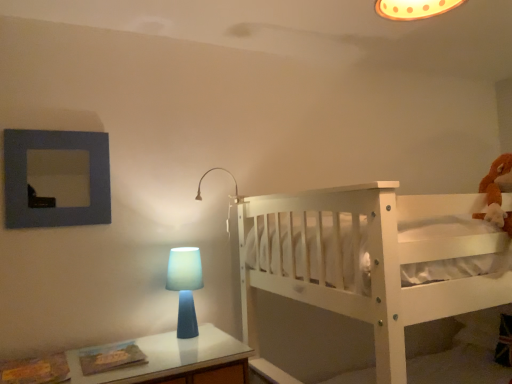
Question: Is point (198, 200) positioned closer to the camera than point (61, 190)?

Choices:
 (A) farther
 (B) closer

Answer: (A)

Question: Considering the positions of matte white lamp at upper center and blue matte picture frame at upper left in the image, is matte white lamp at upper center taller or shorter than blue matte picture frame at upper left?

Choices:
 (A) tall
 (B) short

Answer: (B)

Question: Which object is the farthest from the white wooden bunk bed at right?

Choices:
 (A) blue matte table lamp at center
 (B) blue matte picture frame at upper left
 (C) matte white lamp at upper center

Answer: (B)

Question: Which of these objects is positioned closest to the blue matte picture frame at upper left?

Choices:
 (A) blue matte table lamp at center
 (B) matte white lamp at upper center
 (C) white wooden bunk bed at right

Answer: (A)